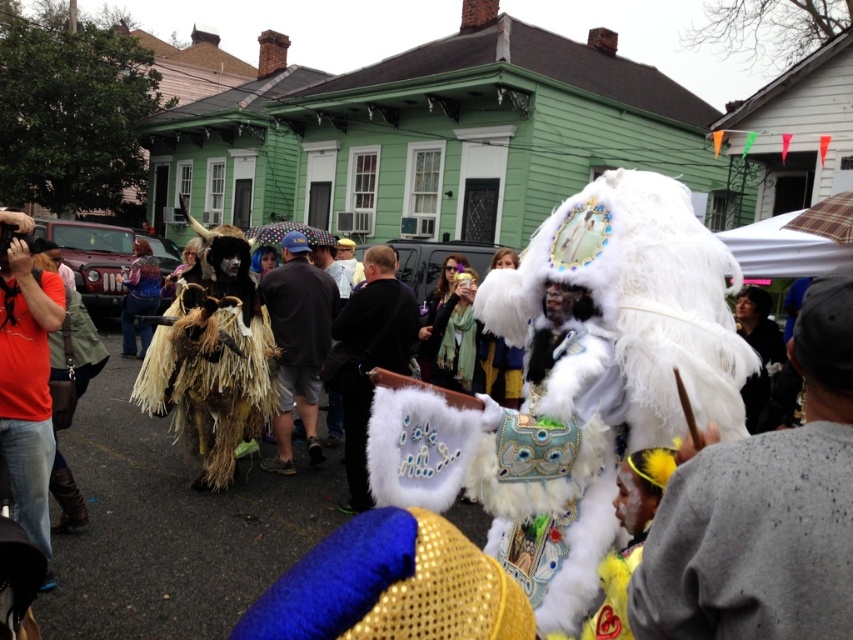
Does matte red shirt at left appear on the right side of shiny black jacket at center?

No, matte red shirt at left is not to the right of shiny black jacket at center.

Which is above, matte red shirt at left or shiny black jacket at center?

shiny black jacket at center is above.

Is point (9, 422) positioned behind point (349, 269)?

No.

Locate an element on the screen. matte red shirt at left is located at coordinates (27, 387).

Based on the photo, does matte red shirt at left have a smaller size compared to brown straw costume at center?

Yes, matte red shirt at left is smaller than brown straw costume at center.

Between matte red shirt at left and brown straw costume at center, which one appears on the right side from the viewer's perspective?

brown straw costume at center is more to the right.

What do you see at coordinates (27, 387) in the screenshot?
I see `matte red shirt at left` at bounding box center [27, 387].

This screenshot has width=853, height=640. I want to click on matte red shirt at left, so click(x=27, y=387).

Is white fluffy headdress at center to the right of shiny black jacket at center from the viewer's perspective?

Yes, white fluffy headdress at center is to the right of shiny black jacket at center.

Is white fluffy headdress at center bigger than shiny black jacket at center?

Yes.

You are a GUI agent. You are given a task and a screenshot of the screen. Output one action in this format:
    pyautogui.click(x=<x>, y=<y>)
    Task: Click on the white fluffy headdress at center
    The image size is (853, 640).
    Given the screenshot: What is the action you would take?
    pyautogui.click(x=763, y=509)